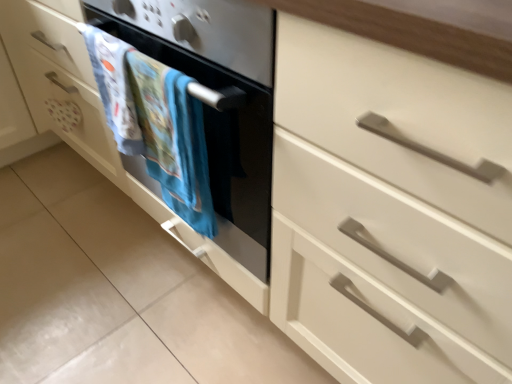
Describe the element at coordinates (155, 124) in the screenshot. This screenshot has width=512, height=384. I see `blue cotton towel at center` at that location.

The height and width of the screenshot is (384, 512). In order to click on blue cotton towel at center in this screenshot , I will do `click(155, 124)`.

Where is `blue cotton towel at center`? This screenshot has width=512, height=384. blue cotton towel at center is located at coordinates (155, 124).